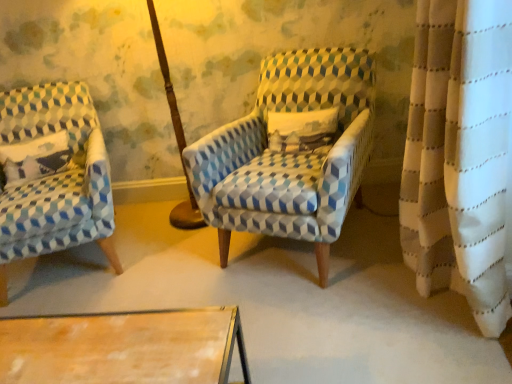
Question: Considering the relative sizes of white cotton pillow at left and blue and white patterned armchair at center, the second chair from the left, in the image provided, is white cotton pillow at left thinner than blue and white patterned armchair at center, the second chair from the left,?

Choices:
 (A) yes
 (B) no

Answer: (A)

Question: Is white cotton pillow at left to the left of blue and white patterned armchair at center, the second chair from the left, from the viewer's perspective?

Choices:
 (A) yes
 (B) no

Answer: (A)

Question: From a real-world perspective, does white cotton pillow at left sit lower than blue and white patterned armchair at center, the second chair from the left?

Choices:
 (A) no
 (B) yes

Answer: (A)

Question: Is white cotton pillow at left touching blue and white patterned armchair at center, the second chair from the left?

Choices:
 (A) no
 (B) yes

Answer: (A)

Question: Is white cotton pillow at left turned away from blue and white patterned armchair at center, the first chair from the right?

Choices:
 (A) no
 (B) yes

Answer: (A)

Question: Considering the relative positions of blue and white patterned armchair at center, the second chair from the left, and blue and white geometric-patterned armchair at left, positioned as the second chair in right-to-left order, in the image provided, is blue and white patterned armchair at center, the second chair from the left, to the left or to the right of blue and white geometric-patterned armchair at left, positioned as the second chair in right-to-left order,?

Choices:
 (A) right
 (B) left

Answer: (A)

Question: Is blue and white patterned armchair at center, the first chair from the right, inside or outside of blue and white geometric-patterned armchair at left, positioned as the second chair in right-to-left order?

Choices:
 (A) inside
 (B) outside

Answer: (B)

Question: Is blue and white patterned armchair at center, the first chair from the right, taller or shorter than blue and white geometric-patterned armchair at left, positioned as the second chair in right-to-left order?

Choices:
 (A) short
 (B) tall

Answer: (A)

Question: From the image's perspective, is blue and white patterned armchair at center, the first chair from the right, above or below blue and white geometric-patterned armchair at left, arranged as the first chair when viewed from the left?

Choices:
 (A) below
 (B) above

Answer: (B)

Question: In terms of height, does blue and white geometric-patterned armchair at left, positioned as the second chair in right-to-left order, look taller or shorter compared to blue and white patterned armchair at center, the second chair from the left?

Choices:
 (A) short
 (B) tall

Answer: (B)

Question: Does point (76, 160) appear closer or farther from the camera than point (349, 157)?

Choices:
 (A) farther
 (B) closer

Answer: (A)

Question: From a real-world perspective, is blue and white geometric-patterned armchair at left, positioned as the second chair in right-to-left order, above or below blue and white patterned armchair at center, the second chair from the left?

Choices:
 (A) above
 (B) below

Answer: (B)

Question: Is blue and white geometric-patterned armchair at left, positioned as the second chair in right-to-left order, bigger or smaller than blue and white patterned armchair at center, the first chair from the right?

Choices:
 (A) big
 (B) small

Answer: (A)

Question: Considering the positions of white cotton pillow at left and blue and white patterned armchair at center, the first chair from the right, in the image, is white cotton pillow at left wider or thinner than blue and white patterned armchair at center, the first chair from the right,?

Choices:
 (A) wide
 (B) thin

Answer: (B)

Question: From a real-world perspective, is white cotton pillow at left above or below blue and white patterned armchair at center, the second chair from the left?

Choices:
 (A) below
 (B) above

Answer: (B)